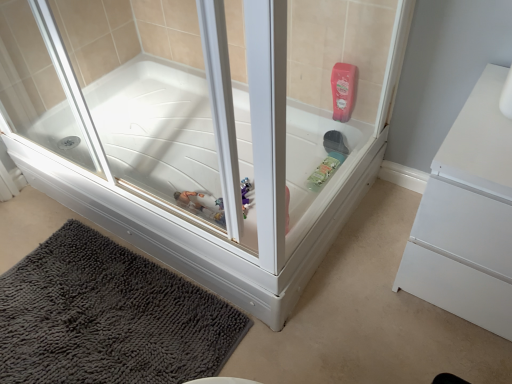
What do you see at coordinates (203, 127) in the screenshot?
I see `white glossy bathtub at center` at bounding box center [203, 127].

In order to face white glossy bathtub at center, should I rotate leftwards or rightwards?

A 22.302 degree turn to the left will do.

What do you see at coordinates (108, 317) in the screenshot? I see `dark gray shaggy bath mat at lower left` at bounding box center [108, 317].

Locate an element on the screen. This screenshot has width=512, height=384. white glossy bathtub at center is located at coordinates (203, 127).

Who is taller, dark gray shaggy bath mat at lower left or white matte dresser at right?

With more height is white matte dresser at right.

Is dark gray shaggy bath mat at lower left wider than white matte dresser at right?

Yes, dark gray shaggy bath mat at lower left is wider than white matte dresser at right.

In the scene shown: Which is more to the right, dark gray shaggy bath mat at lower left or white matte dresser at right?

From the viewer's perspective, white matte dresser at right appears more on the right side.

Can white glossy bathtub at center be found inside dark gray shaggy bath mat at lower left?

No, dark gray shaggy bath mat at lower left does not contain white glossy bathtub at center.

Are dark gray shaggy bath mat at lower left and white glossy bathtub at center beside each other?

dark gray shaggy bath mat at lower left and white glossy bathtub at center are not in contact.

Is dark gray shaggy bath mat at lower left shorter than white glossy bathtub at center?

Yes, dark gray shaggy bath mat at lower left is shorter than white glossy bathtub at center.

Between dark gray shaggy bath mat at lower left and white glossy bathtub at center, which one appears on the right side from the viewer's perspective?

From the viewer's perspective, dark gray shaggy bath mat at lower left appears more on the right side.

From the image's perspective, does white glossy bathtub at center appear higher than dark gray shaggy bath mat at lower left?

Yes.

Based on their sizes in the image, would you say white glossy bathtub at center is bigger or smaller than dark gray shaggy bath mat at lower left?

Considering their sizes, white glossy bathtub at center takes up more space than dark gray shaggy bath mat at lower left.

Is white glossy bathtub at center far away from dark gray shaggy bath mat at lower left?

They are positioned close to each other.

From the image's perspective, is white matte dresser at right located above or below white glossy bathtub at center?

white matte dresser at right is below white glossy bathtub at center.

Considering the sizes of objects white matte dresser at right and white glossy bathtub at center in the image provided, who is shorter, white matte dresser at right or white glossy bathtub at center?

Standing shorter between the two is white matte dresser at right.

Is white matte dresser at right not within white glossy bathtub at center?

white matte dresser at right lies outside white glossy bathtub at center's area.

Which is nearer, (440, 207) or (109, 158)?

Point (440, 207).

This screenshot has width=512, height=384. I want to click on dresser located on the right of dark gray shaggy bath mat at lower left, so click(467, 216).

Is the position of white matte dresser at right more distant than that of dark gray shaggy bath mat at lower left?

No, the depth of white matte dresser at right is less than that of dark gray shaggy bath mat at lower left.

Considering the relative positions of white matte dresser at right and dark gray shaggy bath mat at lower left in the image provided, is white matte dresser at right to the left of dark gray shaggy bath mat at lower left from the viewer's perspective?

No, white matte dresser at right is not to the left of dark gray shaggy bath mat at lower left.

In the scene shown: Is white matte dresser at right next to dark gray shaggy bath mat at lower left?

No, white matte dresser at right is not making contact with dark gray shaggy bath mat at lower left.

Is white glossy bathtub at center positioned beyond the bounds of white matte dresser at right?

Yes.

From the image's perspective, which object appears higher, white glossy bathtub at center or white matte dresser at right?

white glossy bathtub at center appears higher in the image.

From the picture: How many degrees apart are the facing directions of white glossy bathtub at center and white matte dresser at right?

2.49 degrees separate the facing orientations of white glossy bathtub at center and white matte dresser at right.

The height and width of the screenshot is (384, 512). I want to click on dresser in front of the dark gray shaggy bath mat at lower left, so click(467, 216).

I want to click on bath mat on the right of white glossy bathtub at center, so click(108, 317).

When comparing their distances from white glossy bathtub at center, does white matte dresser at right or dark gray shaggy bath mat at lower left seem further?

Among the two, white matte dresser at right is located further to white glossy bathtub at center.

From the image, which object appears to be nearer to white matte dresser at right, white glossy bathtub at center or dark gray shaggy bath mat at lower left?

Among the two, white glossy bathtub at center is located nearer to white matte dresser at right.

Estimate the real-world distances between objects in this image. Which object is closer to dark gray shaggy bath mat at lower left, white glossy bathtub at center or white matte dresser at right?

white glossy bathtub at center lies closer to dark gray shaggy bath mat at lower left than the other object.

When comparing their distances from white matte dresser at right, does dark gray shaggy bath mat at lower left or white glossy bathtub at center seem closer?

The object closer to white matte dresser at right is white glossy bathtub at center.

When comparing their distances from white glossy bathtub at center, does dark gray shaggy bath mat at lower left or white matte dresser at right seem further?

white matte dresser at right is further to white glossy bathtub at center.

Estimate the real-world distances between objects in this image. Which object is closer to dark gray shaggy bath mat at lower left, white matte dresser at right or white glossy bathtub at center?

Based on the image, white glossy bathtub at center appears to be nearer to dark gray shaggy bath mat at lower left.

Locate an element on the screen. This screenshot has height=384, width=512. bath mat situated between white glossy bathtub at center and white matte dresser at right from left to right is located at coordinates (108, 317).